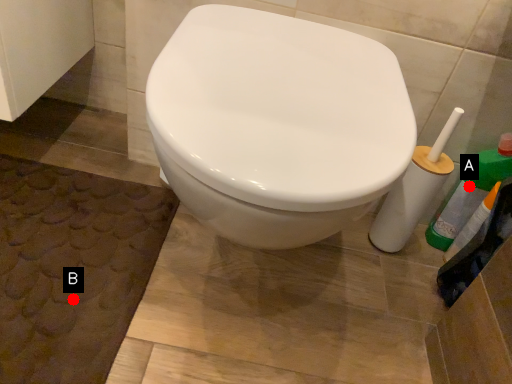
Question: Two points are circled on the image, labeled by A and B beside each circle. Among these points, which one is farthest from the camera?

Choices:
 (A) A is further
 (B) B is further

Answer: (A)